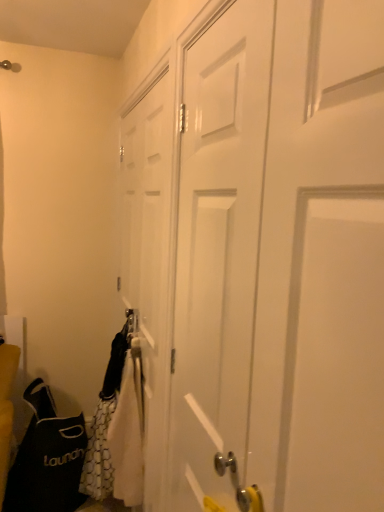
Describe the element at coordinates (47, 459) in the screenshot. The width and height of the screenshot is (384, 512). I see `black fabric laundry bag at lower left` at that location.

Locate an element on the screen. This screenshot has width=384, height=512. black fabric laundry bag at lower left is located at coordinates (47, 459).

Where is `white matte door at center, which is counted as the first door, starting from the front`? The height and width of the screenshot is (512, 384). white matte door at center, which is counted as the first door, starting from the front is located at coordinates (260, 254).

Is white matte door at center, which is counted as the first door, starting from the front, not near black fabric laundry bag at lower left?

Yes, white matte door at center, which is counted as the first door, starting from the front, and black fabric laundry bag at lower left are located far from each other.

From a real-world perspective, which is physically above, white matte door at center, which is counted as the first door, starting from the front, or black fabric laundry bag at lower left?

white matte door at center, which is counted as the first door, starting from the front.

Which is correct: white matte door at center, the second door in the back-to-front sequence, is inside black fabric laundry bag at lower left, or outside of it?

white matte door at center, the second door in the back-to-front sequence, is spatially situated outside black fabric laundry bag at lower left.

The height and width of the screenshot is (512, 384). I want to click on shoulder bag to the left of white matte door at center, which is counted as the first door, starting from the front, so click(x=47, y=459).

Considering the sizes of objects white matte door at center, the second door in the back-to-front sequence, and white matte door at center, the first door viewed from the back, in the image provided, who is smaller, white matte door at center, the second door in the back-to-front sequence, or white matte door at center, the first door viewed from the back,?

Smaller between the two is white matte door at center, the first door viewed from the back.

Can we say white matte door at center, the second door in the back-to-front sequence, lies outside white matte door at center, which appears as the second door when viewed from the front?

That's correct, white matte door at center, the second door in the back-to-front sequence, is outside of white matte door at center, which appears as the second door when viewed from the front.

How different are the orientations of white matte door at center, which is counted as the first door, starting from the front, and white matte door at center, the first door viewed from the back, in degrees?

The angle between the facing direction of white matte door at center, which is counted as the first door, starting from the front, and the facing direction of white matte door at center, the first door viewed from the back, is 0.00962 degrees.

Is white matte door at center, which is counted as the first door, starting from the front, next to white matte door at center, the first door viewed from the back, and touching it?

No, white matte door at center, which is counted as the first door, starting from the front, is not touching white matte door at center, the first door viewed from the back.

Can you confirm if black fabric laundry bag at lower left is wider than white matte door at center, the second door in the back-to-front sequence?

Yes, black fabric laundry bag at lower left is wider than white matte door at center, the second door in the back-to-front sequence.

Is black fabric laundry bag at lower left behind white matte door at center, the second door in the back-to-front sequence?

Yes, it is behind white matte door at center, the second door in the back-to-front sequence.

Could you tell me if black fabric laundry bag at lower left is turned towards white matte door at center, the second door in the back-to-front sequence?

No, black fabric laundry bag at lower left is not oriented towards white matte door at center, the second door in the back-to-front sequence.

Is black fabric laundry bag at lower left with white matte door at center, which is counted as the first door, starting from the front?

No, black fabric laundry bag at lower left is not with white matte door at center, which is counted as the first door, starting from the front.

From a real-world perspective, which is physically below, white matte door at center, the first door viewed from the back, or black fabric laundry bag at lower left?

From a 3D spatial view, black fabric laundry bag at lower left is below.

Considering the sizes of white matte door at center, the first door viewed from the back, and black fabric laundry bag at lower left in the image, is white matte door at center, the first door viewed from the back, taller or shorter than black fabric laundry bag at lower left?

Clearly, white matte door at center, the first door viewed from the back, is taller compared to black fabric laundry bag at lower left.

Looking at this image, is white matte door at center, the first door viewed from the back, wider or thinner than black fabric laundry bag at lower left?

Clearly, white matte door at center, the first door viewed from the back, has less width compared to black fabric laundry bag at lower left.

From the picture: Looking at the image, does white matte door at center, which appears as the second door when viewed from the front, seem bigger or smaller compared to white matte door at center, the second door in the back-to-front sequence?

white matte door at center, which appears as the second door when viewed from the front, is smaller than white matte door at center, the second door in the back-to-front sequence.

Which object is positioned more to the left, white matte door at center, the first door viewed from the back, or white matte door at center, which is counted as the first door, starting from the front?

white matte door at center, the first door viewed from the back.

Is white matte door at center, the first door viewed from the back, situated inside white matte door at center, which is counted as the first door, starting from the front, or outside?

white matte door at center, the first door viewed from the back, is spatially positioned inside white matte door at center, which is counted as the first door, starting from the front.

What's the angular difference between white matte door at center, the first door viewed from the back, and white matte door at center, the second door in the back-to-front sequence,'s facing directions?

0.00962 degrees separate the facing orientations of white matte door at center, the first door viewed from the back, and white matte door at center, the second door in the back-to-front sequence.

Does black fabric laundry bag at lower left have a greater height compared to white matte door at center, which appears as the second door when viewed from the front?

No.

Can you see black fabric laundry bag at lower left touching white matte door at center, which appears as the second door when viewed from the front?

No.

From a real-world perspective, is black fabric laundry bag at lower left under white matte door at center, the first door viewed from the back?

Yes, from a real-world perspective, black fabric laundry bag at lower left is below white matte door at center, the first door viewed from the back.

At what (x,y) coordinates should I click in order to perform the action: click on the 2nd door above when counting from the black fabric laundry bag at lower left (from the image's perspective). Please return your answer as a coordinate pair (x, y). Image resolution: width=384 pixels, height=512 pixels. Looking at the image, I should click on (148, 243).

Find the location of a particular element. the 2nd door in front when counting from the black fabric laundry bag at lower left is located at coordinates (260, 254).

Find the location of `door on the left of the white matte door at center, which is counted as the first door, starting from the front`. door on the left of the white matte door at center, which is counted as the first door, starting from the front is located at coordinates (148, 243).

From the image, which object appears to be farther from white matte door at center, which is counted as the first door, starting from the front, black fabric laundry bag at lower left or white matte door at center, the first door viewed from the back?

Based on the image, black fabric laundry bag at lower left appears to be further to white matte door at center, which is counted as the first door, starting from the front.

Based on their spatial positions, is black fabric laundry bag at lower left or white matte door at center, the second door in the back-to-front sequence, closer to white matte door at center, the first door viewed from the back?

Among the two, white matte door at center, the second door in the back-to-front sequence, is located nearer to white matte door at center, the first door viewed from the back.

Looking at this image, considering their positions, is white matte door at center, the second door in the back-to-front sequence, positioned closer to white matte door at center, which appears as the second door when viewed from the front, than black fabric laundry bag at lower left?

Based on the image, white matte door at center, the second door in the back-to-front sequence, appears to be nearer to white matte door at center, which appears as the second door when viewed from the front.

Which object lies nearer to the anchor point white matte door at center, the second door in the back-to-front sequence, white matte door at center, which appears as the second door when viewed from the front, or black fabric laundry bag at lower left?

white matte door at center, which appears as the second door when viewed from the front.

Based on their spatial positions, is white matte door at center, the second door in the back-to-front sequence, or white matte door at center, which appears as the second door when viewed from the front, further from black fabric laundry bag at lower left?

The object further to black fabric laundry bag at lower left is white matte door at center, the second door in the back-to-front sequence.

From the image, which object appears to be farther from black fabric laundry bag at lower left, white matte door at center, which appears as the second door when viewed from the front, or white matte door at center, which is counted as the first door, starting from the front?

white matte door at center, which is counted as the first door, starting from the front, is further to black fabric laundry bag at lower left.

Where is `door positioned between white matte door at center, the second door in the back-to-front sequence, and black fabric laundry bag at lower left from near to far`? door positioned between white matte door at center, the second door in the back-to-front sequence, and black fabric laundry bag at lower left from near to far is located at coordinates (148, 243).